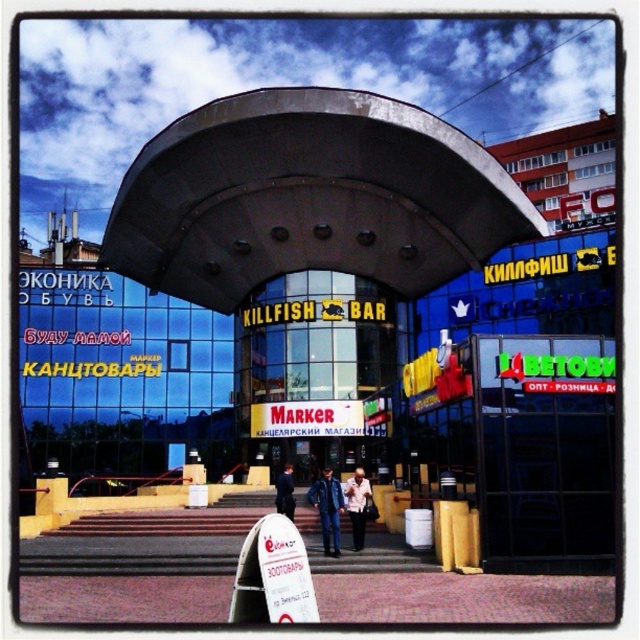
Which of these two, white plastic sign at center or red plastic marker at center, stands shorter?

Standing shorter between the two is red plastic marker at center.

Consider the image. Is white plastic sign at center to the left of red plastic marker at center from the viewer's perspective?

Yes, white plastic sign at center is to the left of red plastic marker at center.

Identify the location of white plastic sign at center. This screenshot has width=640, height=640. (284, 572).

At what (x,y) coordinates should I click in order to perform the action: click on white plastic sign at center. Please return your answer as a coordinate pair (x, y). The image size is (640, 640). Looking at the image, I should click on (284, 572).

Between blue denim jacket at center and dark blue jacket at center, which one appears on the left side from the viewer's perspective?

Positioned to the left is dark blue jacket at center.

Measure the distance between blue denim jacket at center and camera.

183.93 feet

Where is `blue denim jacket at center`? This screenshot has width=640, height=640. blue denim jacket at center is located at coordinates (326, 508).

Is white plastic sign at center shorter than light brown leather jacket at center?

No, white plastic sign at center is not shorter than light brown leather jacket at center.

Is white plastic sign at center in front of light brown leather jacket at center?

That is True.

Who is more distant from viewer, (268, 596) or (364, 481)?

Point (364, 481)

This screenshot has height=640, width=640. Find the location of `white plastic sign at center`. white plastic sign at center is located at coordinates (284, 572).